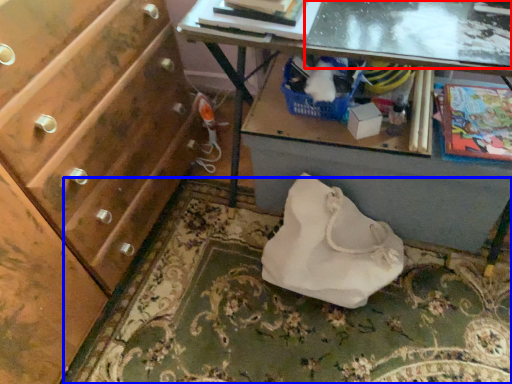
Question: Which object appears farthest to the camera in this image, glass table (highlighted by a red box) or mat (highlighted by a blue box)?

Choices:
 (A) glass table
 (B) mat

Answer: (B)